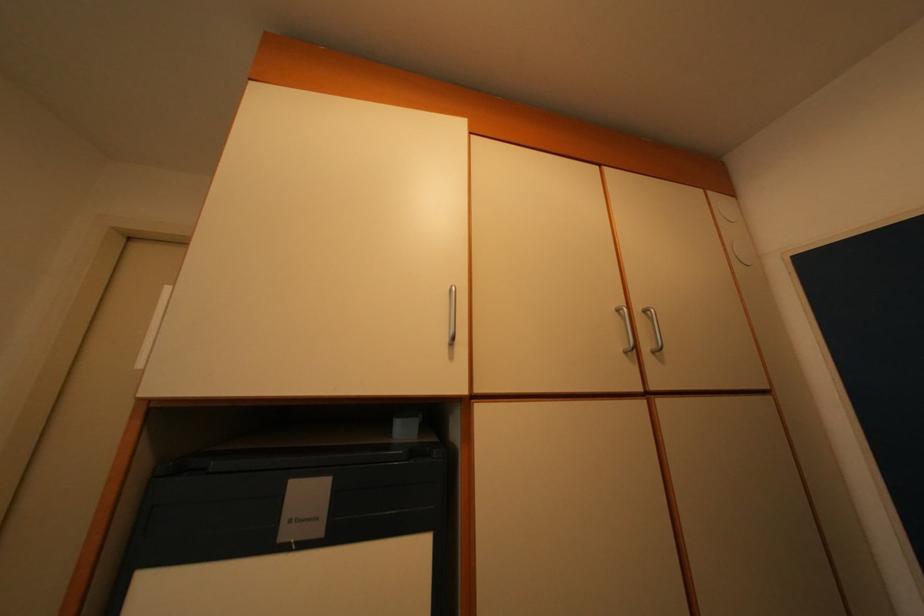
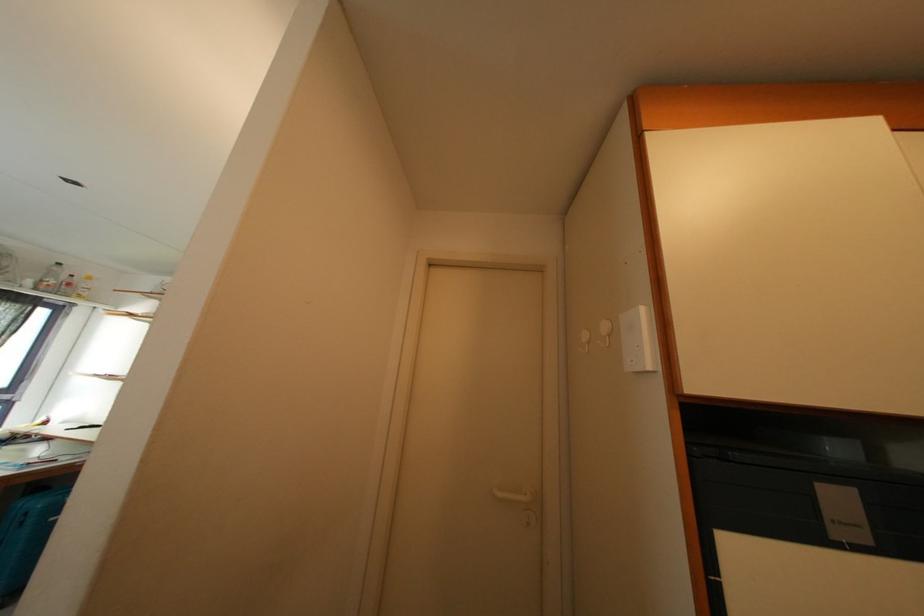
Question: The camera is either moving clockwise (left) or counter-clockwise (right) around the object. The first image is from the beginning of the video and the second image is from the end. Is the camera moving left or right when shooting the video?

Choices:
 (A) Left
 (B) Right

Answer: (B)